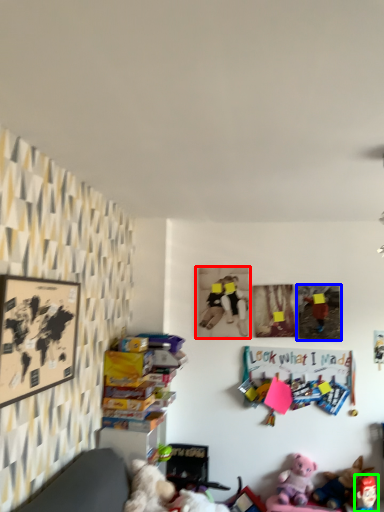
Question: Which is farther away from picture frame (highlighted by a red box)? picture frame (highlighted by a blue box) or toy (highlighted by a green box)?

Choices:
 (A) picture frame
 (B) toy

Answer: (B)